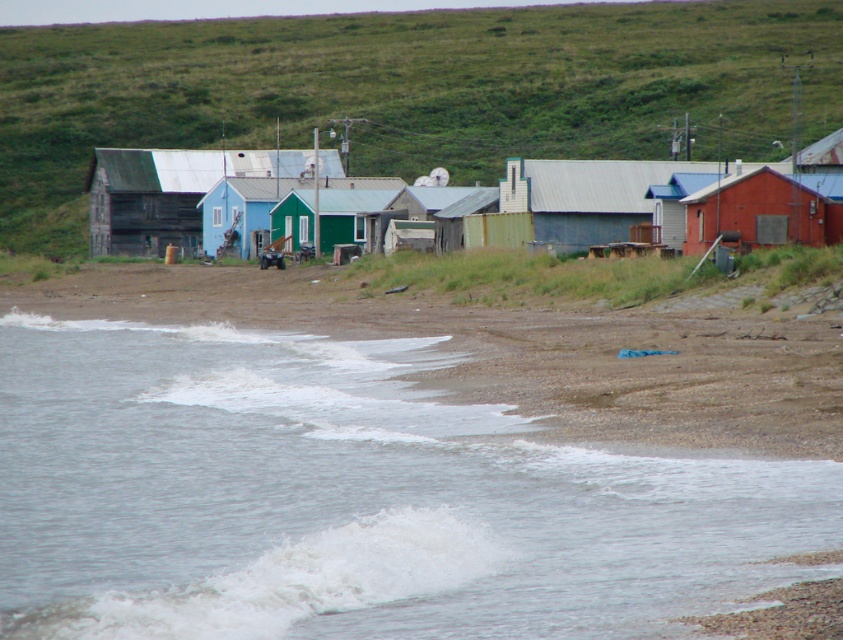
In the scene shown: Is green grassy hillside at upper center thinner than blue wooden house at center?

In fact, green grassy hillside at upper center might be wider than blue wooden house at center.

Can you confirm if green grassy hillside at upper center is positioned to the left of blue wooden house at center?

No, green grassy hillside at upper center is not to the left of blue wooden house at center.

Who is more forward, (605,13) or (224,205)?

Positioned in front is point (224,205).

This screenshot has width=843, height=640. Identify the location of green grassy hillside at upper center. (406, 92).

Is point (648, 140) farther from viewer compared to point (670, 168)?

Yes, point (648, 140) is farther from viewer.

Is green grassy hillside at upper center further to camera compared to metallic gray hut at center-right?

Yes, green grassy hillside at upper center is further from the viewer.

Locate an element on the screen. This screenshot has height=640, width=843. green grassy hillside at upper center is located at coordinates (406, 92).

At what (x,y) coordinates should I click in order to perform the action: click on green grassy hillside at upper center. Please return your answer as a coordinate pair (x, y). The height and width of the screenshot is (640, 843). Looking at the image, I should click on pos(406,92).

Consider the image. Who is positioned more to the left, metallic gray hut at center-right or blue wooden house at center?

From the viewer's perspective, blue wooden house at center appears more on the left side.

Between metallic gray hut at center-right and blue wooden house at center, which one has less height?

Standing shorter between the two is blue wooden house at center.

Between point (562, 236) and point (237, 225), which one is positioned in front?

Point (562, 236) is in front.

Find the location of `metallic gray hut at center-right`. metallic gray hut at center-right is located at coordinates (586, 196).